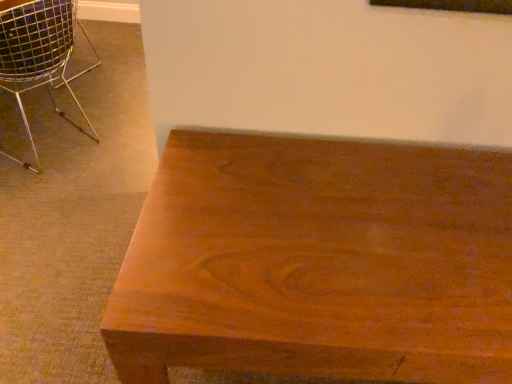
Locate an element on the screen. free space to the back side of metallic wire chair at left is located at coordinates (95, 95).